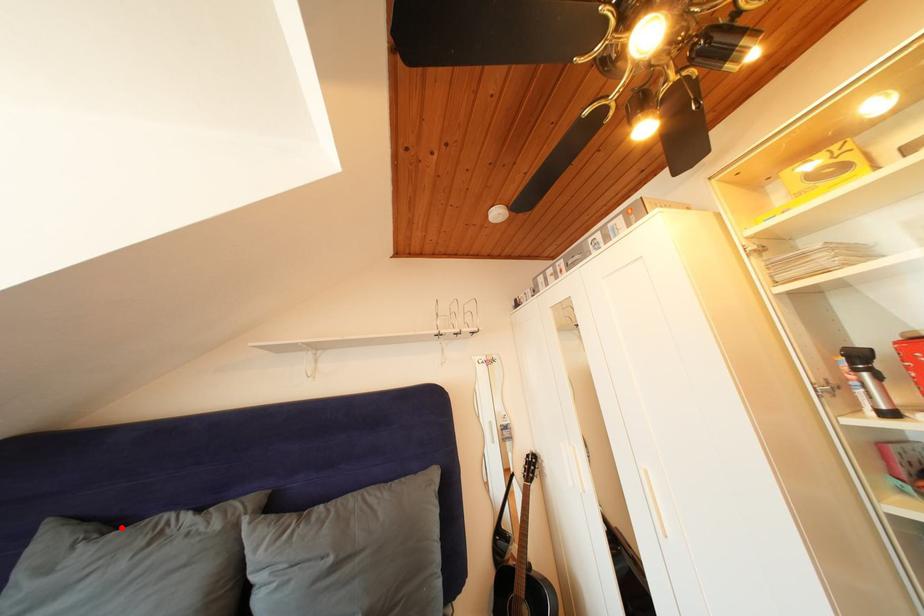
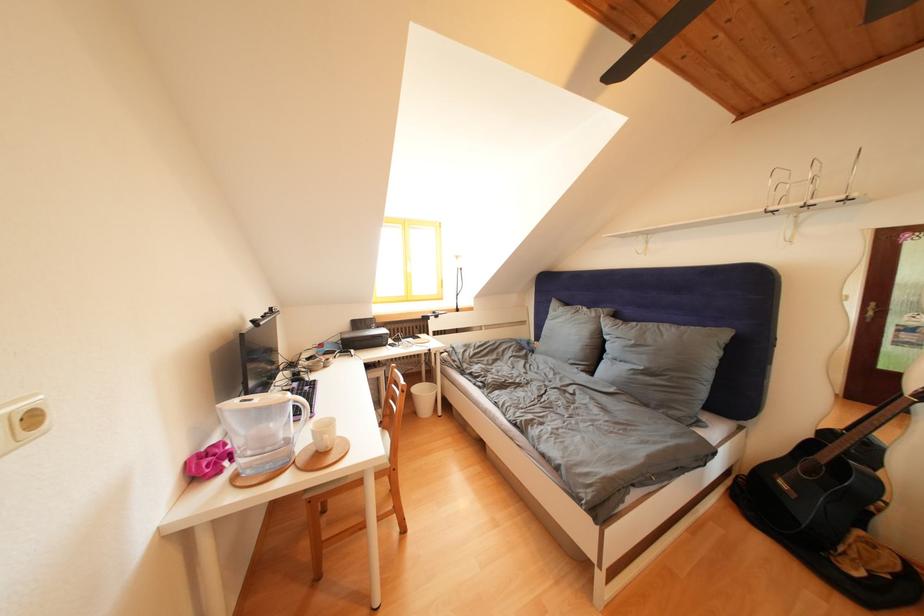
Locate, in the second image, the point that corresponds to the highlighted location in the first image.

(575, 310)